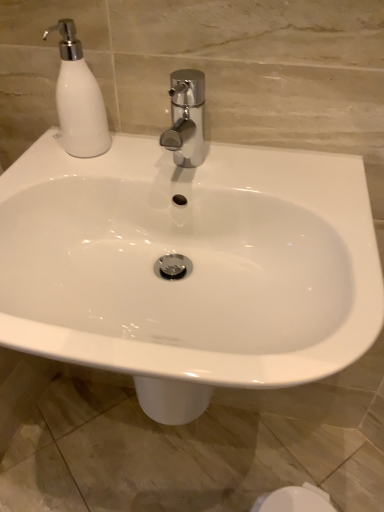
This screenshot has width=384, height=512. Identify the location of vacant point to the left of white glossy soap dispenser at upper left. (39, 152).